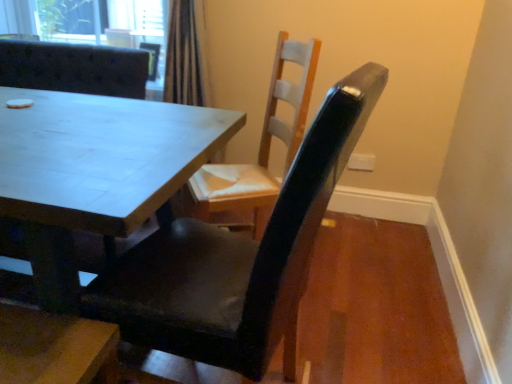
Question: Would you say matte black chair at center, the 2th chair when ordered from left to right, is to the left or to the right of white wood chair at center, which appears as the third chair when viewed from the left, in the picture?

Choices:
 (A) left
 (B) right

Answer: (A)

Question: From a real-world perspective, is matte black chair at center, the 2th chair when ordered from left to right, positioned above or below white wood chair at center, which appears as the third chair when viewed from the left?

Choices:
 (A) above
 (B) below

Answer: (B)

Question: Which is farther from the matte black chair at center, the 2th chair when ordered from left to right?

Choices:
 (A) white wood chair at center, which ranks as the 1th chair in right-to-left order
 (B) matte black chair at center, positioned as the third chair in right-to-left order

Answer: (B)

Question: Estimate the real-world distances between objects in this image. Which object is closer to the matte black chair at center, the 2th chair when ordered from left to right?

Choices:
 (A) white wood chair at center, which ranks as the 1th chair in right-to-left order
 (B) matte black chair at center, positioned as the third chair in right-to-left order

Answer: (A)